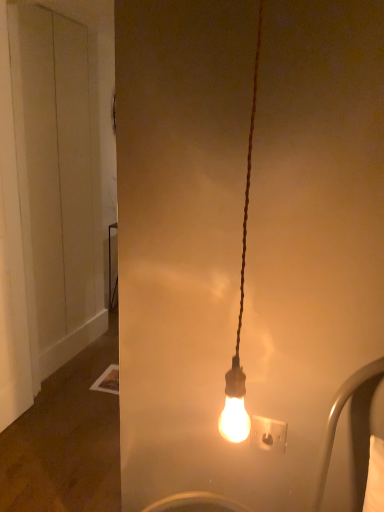
Question: Could you tell me if white plastic socket at center is turned towards white matte door at left?

Choices:
 (A) yes
 (B) no

Answer: (B)

Question: Can you confirm if white plastic socket at center is bigger than white matte door at left?

Choices:
 (A) yes
 (B) no

Answer: (B)

Question: Is white plastic socket at center closer to the viewer compared to white matte door at left?

Choices:
 (A) no
 (B) yes

Answer: (B)

Question: Could white matte door at left be considered to be inside white plastic socket at center?

Choices:
 (A) yes
 (B) no

Answer: (B)

Question: Is white plastic socket at center not inside white matte door at left?

Choices:
 (A) no
 (B) yes

Answer: (B)

Question: Is white plastic socket at center shorter than white matte door at left?

Choices:
 (A) yes
 (B) no

Answer: (A)

Question: From a real-world perspective, is white matte door at left beneath white plastic socket at center?

Choices:
 (A) no
 (B) yes

Answer: (A)

Question: Is white matte door at left at the right side of white plastic socket at center?

Choices:
 (A) yes
 (B) no

Answer: (B)

Question: Can you see white matte door at left touching white plastic socket at center?

Choices:
 (A) yes
 (B) no

Answer: (B)

Question: Is white matte door at left facing away from white plastic socket at center?

Choices:
 (A) no
 (B) yes

Answer: (A)

Question: From the image's perspective, is white matte door at left on white plastic socket at center?

Choices:
 (A) yes
 (B) no

Answer: (A)

Question: From a real-world perspective, is white matte door at left on top of white plastic socket at center?

Choices:
 (A) yes
 (B) no

Answer: (A)

Question: In terms of size, does white matte door at left appear bigger or smaller than white plastic socket at center?

Choices:
 (A) small
 (B) big

Answer: (B)